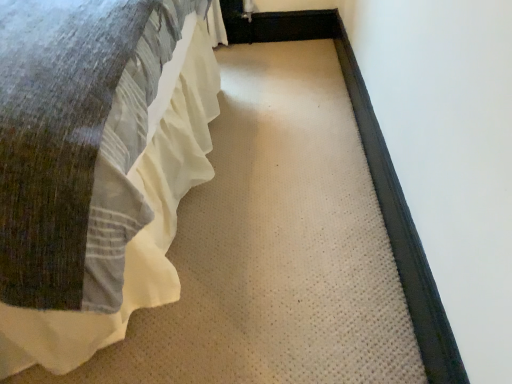
Question: Is black rubber doormat at right wider than white cotton bed at left?

Choices:
 (A) no
 (B) yes

Answer: (A)

Question: Is black rubber doormat at right thinner than white cotton bed at left?

Choices:
 (A) no
 (B) yes

Answer: (B)

Question: Is black rubber doormat at right to the right of white cotton bed at left from the viewer's perspective?

Choices:
 (A) yes
 (B) no

Answer: (A)

Question: From a real-world perspective, does black rubber doormat at right stand above white cotton bed at left?

Choices:
 (A) no
 (B) yes

Answer: (A)

Question: Can you confirm if black rubber doormat at right is smaller than white cotton bed at left?

Choices:
 (A) yes
 (B) no

Answer: (A)

Question: Could you tell me if black rubber doormat at right is turned towards white cotton bed at left?

Choices:
 (A) yes
 (B) no

Answer: (A)

Question: From the image's perspective, is white cotton bed at left located beneath black rubber doormat at right?

Choices:
 (A) no
 (B) yes

Answer: (A)

Question: Is white cotton bed at left next to black rubber doormat at right and touching it?

Choices:
 (A) no
 (B) yes

Answer: (A)

Question: From a real-world perspective, is white cotton bed at left positioned under black rubber doormat at right based on gravity?

Choices:
 (A) yes
 (B) no

Answer: (B)

Question: Is the position of white cotton bed at left less distant than that of black rubber doormat at right?

Choices:
 (A) no
 (B) yes

Answer: (B)

Question: Is there a large distance between white cotton bed at left and black rubber doormat at right?

Choices:
 (A) yes
 (B) no

Answer: (B)

Question: Considering the relative sizes of white cotton bed at left and black rubber doormat at right in the image provided, is white cotton bed at left wider than black rubber doormat at right?

Choices:
 (A) yes
 (B) no

Answer: (A)

Question: Considering the positions of white cotton bed at left and black rubber doormat at right in the image, is white cotton bed at left taller or shorter than black rubber doormat at right?

Choices:
 (A) tall
 (B) short

Answer: (A)